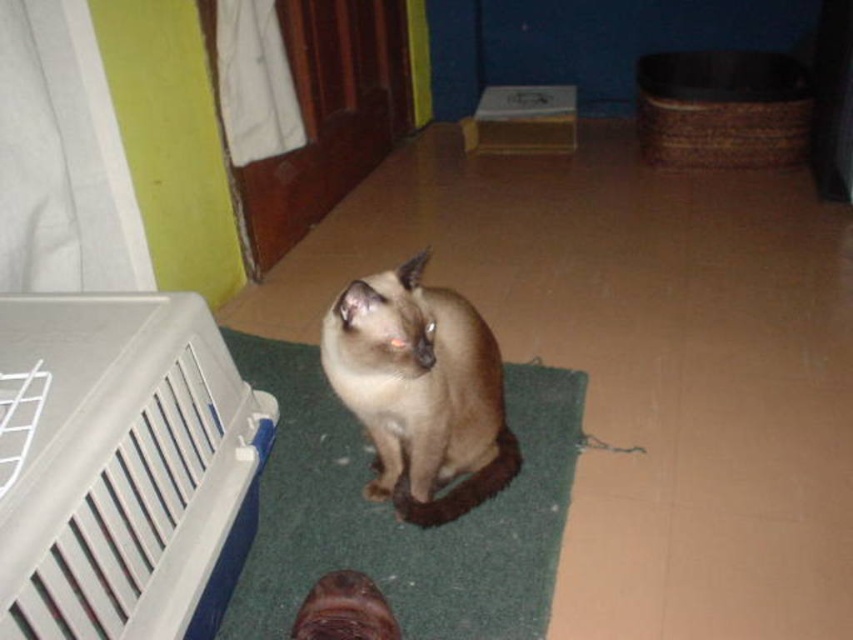
Question: Is white plastic laundry basket at lower left to the left of green carpet at center from the viewer's perspective?

Choices:
 (A) yes
 (B) no

Answer: (A)

Question: Is green carpet at center thinner than smokey brown fur cat at center?

Choices:
 (A) no
 (B) yes

Answer: (A)

Question: Which point is farther to the camera?

Choices:
 (A) smokey brown fur cat at center
 (B) white plastic laundry basket at lower left
 (C) green carpet at center

Answer: (C)

Question: Does white plastic laundry basket at lower left appear over smokey brown fur cat at center?

Choices:
 (A) no
 (B) yes

Answer: (A)

Question: Which object is the farthest from the green carpet at center?

Choices:
 (A) white plastic laundry basket at lower left
 (B) smokey brown fur cat at center

Answer: (A)

Question: Which of the following is the farthest from the observer?

Choices:
 (A) (467, 348)
 (B) (498, 625)

Answer: (A)